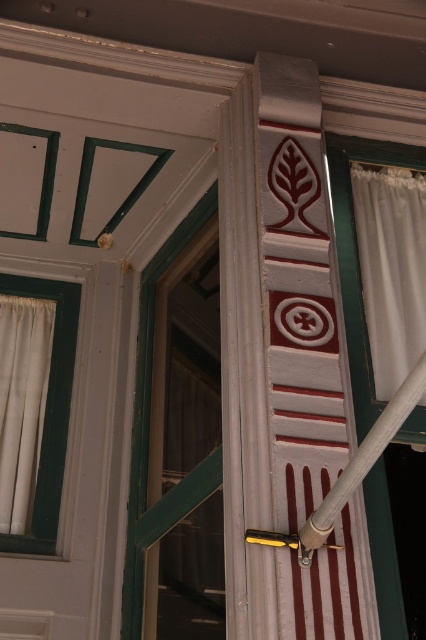
You are an architect examining a historical building and notice two points marked on the column. The first point is located at coordinates point [425,186], and the second is at point [146,275]. From your perspective, which point appears closer to you?

Point [425,186] is in front of point [146,275], so it appears closer to you.

You are standing in front of a decorative architectural detail. You see a green painted wood window at center and a gray matte pole at center. Which object is closer to you?

The green painted wood window at center is closer to you because the gray matte pole at center is behind it.